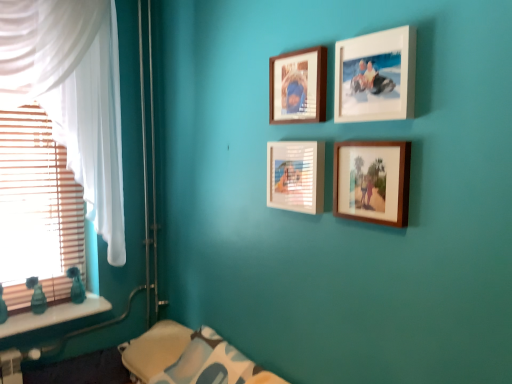
Question: Can you confirm if wooden blinds at left is positioned to the right of wooden photo frame at center-right, acting as the fourth picture frame starting from the top?

Choices:
 (A) yes
 (B) no

Answer: (B)

Question: Is there a large distance between wooden blinds at left and wooden photo frame at center-right, acting as the fourth picture frame starting from the top?

Choices:
 (A) no
 (B) yes

Answer: (B)

Question: From the image's perspective, is wooden blinds at left above wooden photo frame at center-right, which is the first picture frame from bottom to top?

Choices:
 (A) yes
 (B) no

Answer: (B)

Question: Can you confirm if wooden blinds at left is positioned to the left of wooden photo frame at center-right, which is the first picture frame from bottom to top?

Choices:
 (A) no
 (B) yes

Answer: (B)

Question: Is wooden photo frame at center-right, acting as the fourth picture frame starting from the top, a part of wooden blinds at left?

Choices:
 (A) no
 (B) yes

Answer: (A)

Question: Considering the relative sizes of wooden blinds at left and wooden photo frame at center-right, acting as the fourth picture frame starting from the top, in the image provided, is wooden blinds at left smaller than wooden photo frame at center-right, acting as the fourth picture frame starting from the top,?

Choices:
 (A) yes
 (B) no

Answer: (B)

Question: From a real-world perspective, is wooden frame at upper center, the fourth picture frame from the bottom, located beneath wooden blinds at left?

Choices:
 (A) yes
 (B) no

Answer: (B)

Question: Is there a large distance between wooden frame at upper center, which ranks as the 1th picture frame in top-to-bottom order, and wooden blinds at left?

Choices:
 (A) yes
 (B) no

Answer: (A)

Question: Can you confirm if wooden frame at upper center, which ranks as the 1th picture frame in top-to-bottom order, is bigger than wooden blinds at left?

Choices:
 (A) yes
 (B) no

Answer: (B)

Question: Is wooden frame at upper center, the fourth picture frame from the bottom, positioned with its back to wooden blinds at left?

Choices:
 (A) yes
 (B) no

Answer: (B)

Question: Would you say wooden blinds at left is part of wooden frame at upper center, which ranks as the 1th picture frame in top-to-bottom order,'s contents?

Choices:
 (A) no
 (B) yes

Answer: (A)

Question: From the image's perspective, is wooden frame at upper center, which ranks as the 1th picture frame in top-to-bottom order, located above wooden blinds at left?

Choices:
 (A) yes
 (B) no

Answer: (A)

Question: Is white marble window sill at lower left oriented away from soft white fabric pillow at lower center?

Choices:
 (A) no
 (B) yes

Answer: (A)